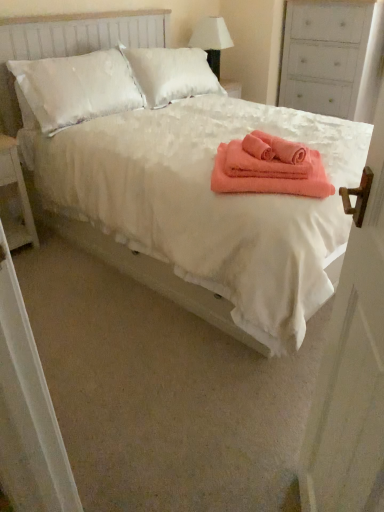
Question: Considering the relative positions of white wood nightstand at left and coral soft towel at center in the image provided, is white wood nightstand at left to the right of coral soft towel at center from the viewer's perspective?

Choices:
 (A) yes
 (B) no

Answer: (B)

Question: From the image's perspective, is white wood nightstand at left over coral soft towel at center?

Choices:
 (A) yes
 (B) no

Answer: (B)

Question: Could you tell me if white wood nightstand at left is turned towards coral soft towel at center?

Choices:
 (A) no
 (B) yes

Answer: (A)

Question: Is white wood nightstand at left further to the viewer compared to coral soft towel at center?

Choices:
 (A) yes
 (B) no

Answer: (A)

Question: Is white wood nightstand at left placed right next to coral soft towel at center?

Choices:
 (A) no
 (B) yes

Answer: (A)

Question: Can you confirm if white wood nightstand at left is taller than coral soft towel at center?

Choices:
 (A) yes
 (B) no

Answer: (B)

Question: Is white fabric lampshade at upper center oriented away from coral plush bath towel at center?

Choices:
 (A) yes
 (B) no

Answer: (B)

Question: Is white fabric lampshade at upper center smaller than coral plush bath towel at center?

Choices:
 (A) no
 (B) yes

Answer: (A)

Question: From the image's perspective, is white fabric lampshade at upper center beneath coral plush bath towel at center?

Choices:
 (A) no
 (B) yes

Answer: (A)

Question: Are white fabric lampshade at upper center and coral plush bath towel at center far apart?

Choices:
 (A) no
 (B) yes

Answer: (B)

Question: Does white fabric lampshade at upper center lie behind coral plush bath towel at center?

Choices:
 (A) no
 (B) yes

Answer: (B)

Question: From a real-world perspective, is white fabric lampshade at upper center below coral plush bath towel at center?

Choices:
 (A) yes
 (B) no

Answer: (B)

Question: Would you say coral soft towel at center contains white wooden door at right?

Choices:
 (A) no
 (B) yes

Answer: (A)